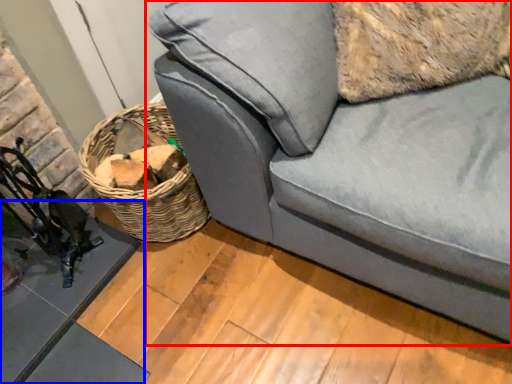
Question: Which object appears closest to the camera in this image, studio couch (highlighted by a red box) or table (highlighted by a blue box)?

Choices:
 (A) studio couch
 (B) table

Answer: (A)